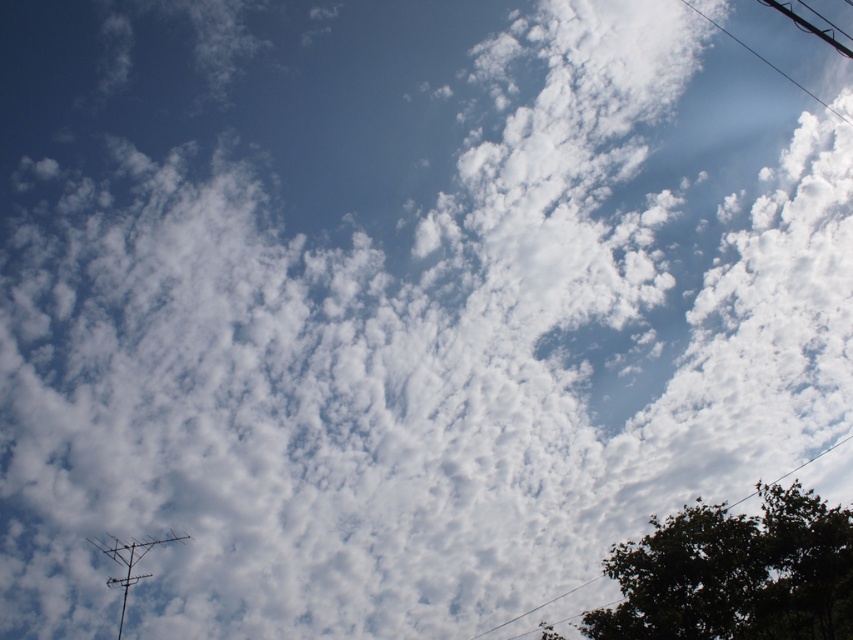
Does dark green leafy tree at lower right appear on the left side of black wire at upper right?

Yes, dark green leafy tree at lower right is to the left of black wire at upper right.

Can you confirm if dark green leafy tree at lower right is thinner than black wire at upper right?

No, dark green leafy tree at lower right is not thinner than black wire at upper right.

Is point (648, 598) less distant than point (820, 102)?

Yes.

Locate an element on the screen. dark green leafy tree at lower right is located at coordinates pos(735,573).

Who is more distant from viewer, (608,570) or (120,577)?

The point (120,577) is behind.

Which of these two, dark green leafy tree at lower right or metallic silver antenna at lower left, stands taller?

With more height is dark green leafy tree at lower right.

Is point (672, 552) positioned after point (144, 552)?

No, (672, 552) is closer to viewer.

Image resolution: width=853 pixels, height=640 pixels. Find the location of `dark green leafy tree at lower right`. dark green leafy tree at lower right is located at coordinates (735, 573).

Is metallic silver antenna at lower left positioned in front of black wire at upper right?

Yes, metallic silver antenna at lower left is closer to the viewer.

Between point (126, 588) and point (824, 104), which one is positioned behind?

The point (824, 104) is behind.

Find the location of a particular element. The width and height of the screenshot is (853, 640). metallic silver antenna at lower left is located at coordinates (131, 561).